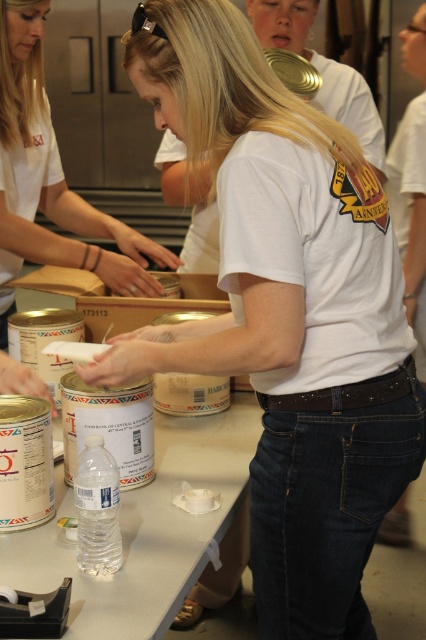
Question: Is white matte shirt at center in front of white matte t-shirt at center?

Choices:
 (A) no
 (B) yes

Answer: (A)

Question: Among these objects, which one is farthest from the camera?

Choices:
 (A) white matte t-shirt at center
 (B) clear plastic bottle at lower center
 (C) white matte shirt at center

Answer: (C)

Question: Which object is positioned farthest from the white matte t-shirt at center?

Choices:
 (A) clear plastic bottle at lower center
 (B) white matte shirt at center

Answer: (A)

Question: Which point is closer to the camera?

Choices:
 (A) white matte shirt at center
 (B) clear plastic bottle at lower center

Answer: (B)

Question: Is clear plastic bottle at lower center to the left of white matte t-shirt at center from the viewer's perspective?

Choices:
 (A) yes
 (B) no

Answer: (A)

Question: Can you confirm if clear plastic bottle at lower center is positioned below white matte t-shirt at center?

Choices:
 (A) no
 (B) yes

Answer: (B)